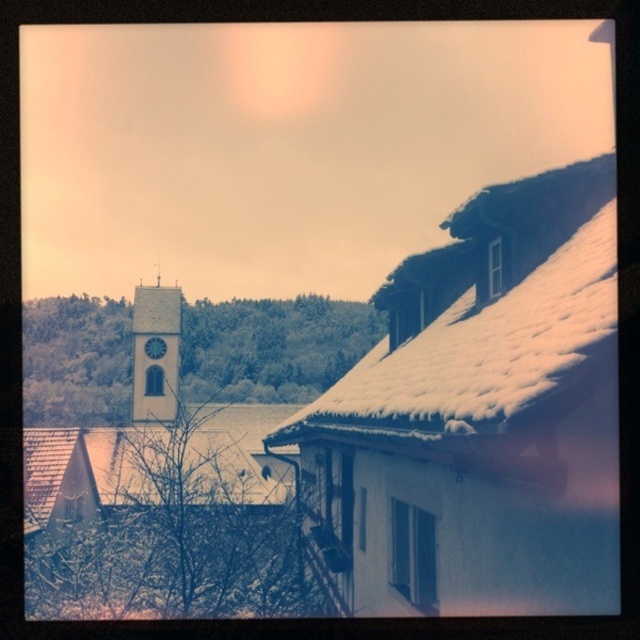
The height and width of the screenshot is (640, 640). What are the coordinates of `white snow-covered roof at upper right` in the screenshot? It's located at (481, 413).

Identify the location of white snow-covered roof at upper right. This screenshot has height=640, width=640. (481, 413).

Image resolution: width=640 pixels, height=640 pixels. I want to click on white stone clock tower at center, so click(156, 353).

Is white stone clock tower at center taller than blue glossy clock at center?

Indeed, white stone clock tower at center has a greater height compared to blue glossy clock at center.

Between point (163, 328) and point (150, 340), which one is positioned in front?

Point (150, 340)

The image size is (640, 640). Identify the location of white stone clock tower at center. (156, 353).

Does white snow-covered roof at upper right appear on the left side of blue glossy clock at center?

In fact, white snow-covered roof at upper right is to the right of blue glossy clock at center.

Who is taller, white snow-covered roof at upper right or blue glossy clock at center?

Standing taller between the two is white snow-covered roof at upper right.

Between point (445, 392) and point (163, 353), which one is positioned behind?

The point (163, 353) is behind.

Where is `white snow-covered roof at upper right`? white snow-covered roof at upper right is located at coordinates (481, 413).